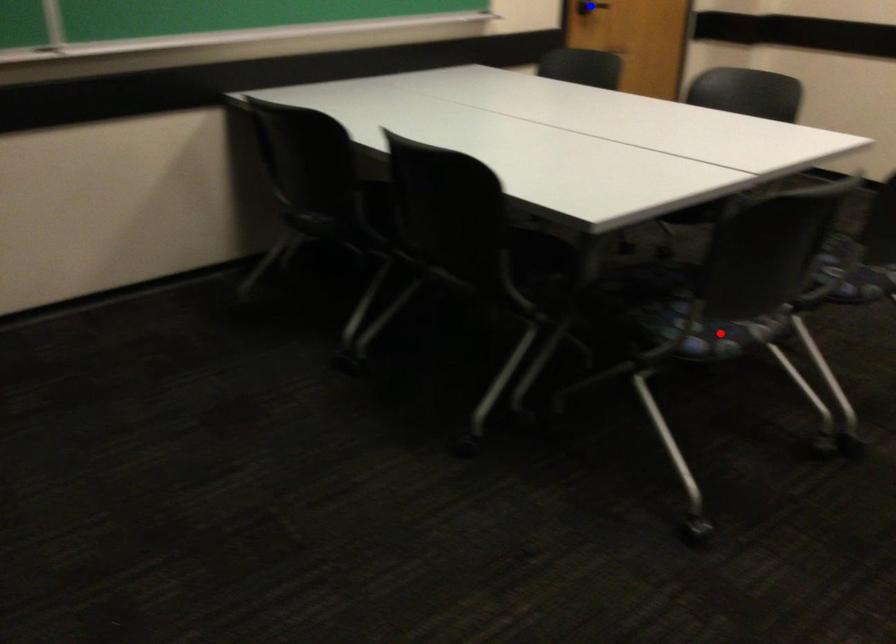
Question: Two points are marked on the image. Which point is closer to the camera?

Choices:
 (A) Blue point is closer.
 (B) Red point is closer.

Answer: (B)